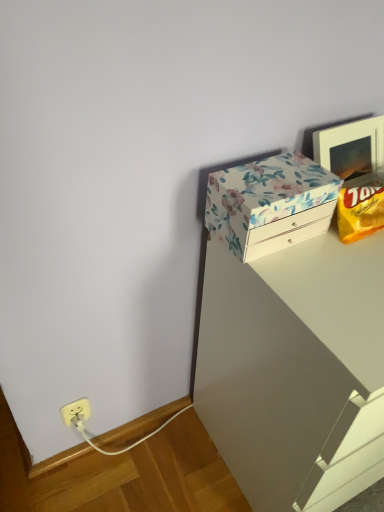
Image resolution: width=384 pixels, height=512 pixels. What do you see at coordinates (360, 212) in the screenshot?
I see `yellow matte chip bag at upper right` at bounding box center [360, 212].

Image resolution: width=384 pixels, height=512 pixels. Identify the location of yellow matte chip bag at upper right. (360, 212).

From a real-world perspective, which object rests below the other?

white glossy vanity at upper right is physically lower.

Is white glossy vanity at upper right with yellow matte chip bag at upper right?

No, white glossy vanity at upper right is not in contact with yellow matte chip bag at upper right.

Can you tell me how much white glossy vanity at upper right and yellow matte chip bag at upper right differ in facing direction?

2.24 degrees separate the facing orientations of white glossy vanity at upper right and yellow matte chip bag at upper right.

Considering the positions of objects white glossy vanity at upper right and yellow matte chip bag at upper right in the image provided, who is more to the left, white glossy vanity at upper right or yellow matte chip bag at upper right?

Positioned to the left is yellow matte chip bag at upper right.

This screenshot has height=512, width=384. Identify the location of box that is behind the white glossy vanity at upper right. (270, 204).

Which is more to the right, floral paper-covered box at upper right or white glossy vanity at upper right?

white glossy vanity at upper right is more to the right.

The image size is (384, 512). In the image, there is a yellow matte chip bag at upper right. In order to click on vanity below it (from a real-world perspective) in this screenshot , I will do (x=288, y=359).

Which of these two, yellow matte chip bag at upper right or white glossy vanity at upper right, is thinner?

yellow matte chip bag at upper right is thinner.

Can white glossy vanity at upper right be found inside yellow matte chip bag at upper right?

No.

Is yellow matte chip bag at upper right a part of floral paper-covered box at upper right?

No.

Can you tell me how much floral paper-covered box at upper right and yellow matte chip bag at upper right differ in facing direction?

There is a 0.000384-degree angle between the facing directions of floral paper-covered box at upper right and yellow matte chip bag at upper right.

Does floral paper-covered box at upper right appear on the right side of yellow matte chip bag at upper right?

No.

Is point (311, 174) positioned in front of point (363, 205)?

Yes, it is.

Is white glossy vanity at upper right oriented away from floral paper-covered box at upper right?

white glossy vanity at upper right does not have its back to floral paper-covered box at upper right.

Considering the sizes of white glossy vanity at upper right and floral paper-covered box at upper right in the image, is white glossy vanity at upper right wider or thinner than floral paper-covered box at upper right?

In the image, white glossy vanity at upper right appears to be wider than floral paper-covered box at upper right.

From a real-world perspective, is white glossy vanity at upper right positioned above or below floral paper-covered box at upper right?

From a real-world perspective, white glossy vanity at upper right is physically below floral paper-covered box at upper right.

Between white glossy vanity at upper right and floral paper-covered box at upper right, which one appears on the left side from the viewer's perspective?

floral paper-covered box at upper right is more to the left.

Considering the sizes of objects yellow matte chip bag at upper right and floral paper-covered box at upper right in the image provided, who is smaller, yellow matte chip bag at upper right or floral paper-covered box at upper right?

Smaller between the two is yellow matte chip bag at upper right.

In the image, is yellow matte chip bag at upper right on the left side or the right side of floral paper-covered box at upper right?

Clearly, yellow matte chip bag at upper right is on the right of floral paper-covered box at upper right in the image.

I want to click on box in front of the yellow matte chip bag at upper right, so (270, 204).

Is yellow matte chip bag at upper right far away from floral paper-covered box at upper right?

No, yellow matte chip bag at upper right is in close proximity to floral paper-covered box at upper right.

Find the location of a particular element. This screenshot has width=384, height=512. vanity located on the right of yellow matte chip bag at upper right is located at coordinates (288, 359).

Where is `vanity in front of the floral paper-covered box at upper right`? Image resolution: width=384 pixels, height=512 pixels. vanity in front of the floral paper-covered box at upper right is located at coordinates (288, 359).

Looking at this image, when comparing their distances from yellow matte chip bag at upper right, does white glossy vanity at upper right or floral paper-covered box at upper right seem closer?

The object closer to yellow matte chip bag at upper right is floral paper-covered box at upper right.

Based on their spatial positions, is yellow matte chip bag at upper right or white glossy vanity at upper right further from floral paper-covered box at upper right?

Based on the image, white glossy vanity at upper right appears to be further to floral paper-covered box at upper right.

When comparing their distances from yellow matte chip bag at upper right, does floral paper-covered box at upper right or white glossy vanity at upper right seem further?

Among the two, white glossy vanity at upper right is located further to yellow matte chip bag at upper right.

Considering their positions, is yellow matte chip bag at upper right positioned closer to white glossy vanity at upper right than floral paper-covered box at upper right?

floral paper-covered box at upper right is positioned closer to the anchor white glossy vanity at upper right.

When comparing their distances from floral paper-covered box at upper right, does white glossy vanity at upper right or yellow matte chip bag at upper right seem closer?

Based on the image, yellow matte chip bag at upper right appears to be nearer to floral paper-covered box at upper right.

From the image, which object appears to be nearer to white glossy vanity at upper right, floral paper-covered box at upper right or yellow matte chip bag at upper right?

floral paper-covered box at upper right.

Locate an element on the screen. wrapping paper between floral paper-covered box at upper right and white glossy vanity at upper right vertically is located at coordinates (360, 212).